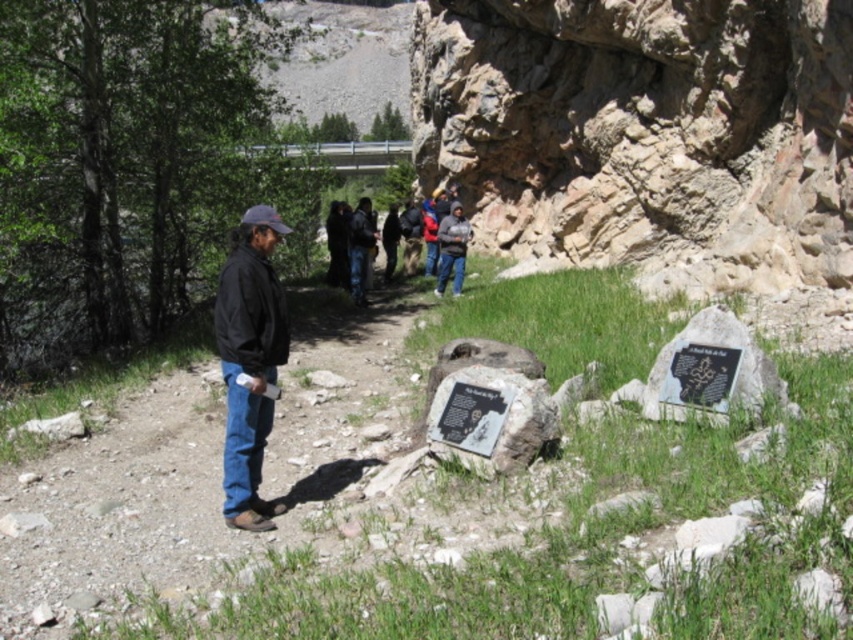
You are navigating a hiking trail and see two points marked on your map. The first point is at coordinates point(729, 368) and the second point is at point(366, 211). If you are facing the direction of the path, which point is closer to you?

Point(729, 368) is in front of point(366, 211), so if you are facing the direction of the path, point(729, 368) is closer to you.

You are a hiker trying to read the gray stone plaque at center while standing near the dark blue jacket at center. Can you easily read the plaque without bending down?

The gray stone plaque at center has a lesser height compared to dark blue jacket at center, so it is shorter than the jacket. Since the jacket is at your height, you would need to bend down slightly to read the plaque.

You are standing at the starting point of the hiking trail and see the dark clothing group at center ahead. If you walk towards them at a speed of 3 meters per minute, how many minutes will it take to reach them?

The dark clothing group at center and viewer are 39.04 meters apart. At a speed of 3 meters per minute, it would take approximately 13.01 minutes to reach them.